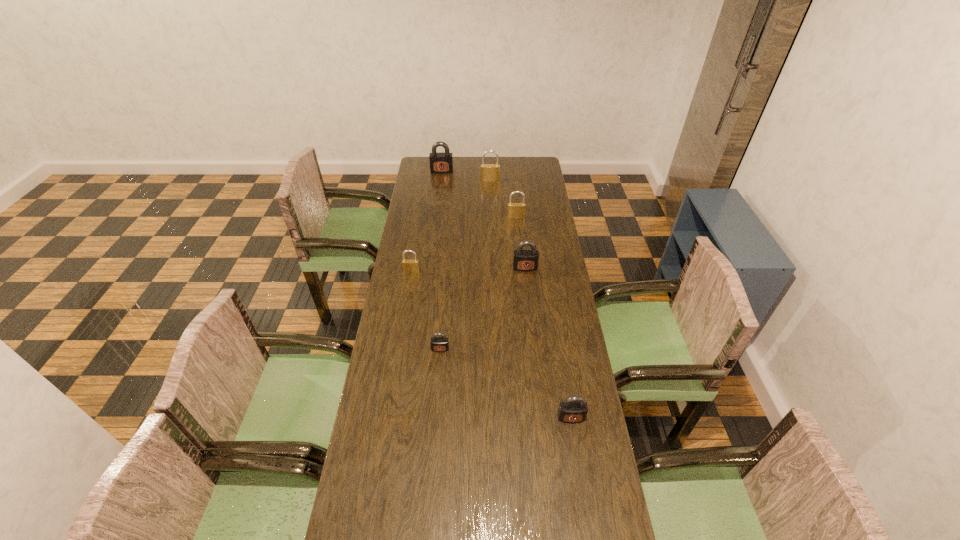
You are a GUI agent. You are given a task and a screenshot of the screen. Output one action in this format:
    pyautogui.click(x=<x>, y=<y>)
    Task: Click on the smallest brass padlock
    
    Given the screenshot: What is the action you would take?
    pyautogui.click(x=409, y=266)

Identify the location of the nearest brass padlock. (409, 266).

At what (x,y) coordinates should I click in order to perform the action: click on the second nearest gray padlock. Please return your answer as a coordinate pair (x, y). Looking at the image, I should click on (438, 344).

Find the location of `the second nearest object`. the second nearest object is located at coordinates (438, 344).

The height and width of the screenshot is (540, 960). Identify the location of vacant space positioned 0.340m on the front of the biggest gray padlock near the keyhole. (438, 210).

Where is `vacant area located on the front-facing side of the biggest brass padlock`? The image size is (960, 540). vacant area located on the front-facing side of the biggest brass padlock is located at coordinates (491, 210).

Identify the location of free location located on the front-facing side of the second farthest brass padlock. Image resolution: width=960 pixels, height=540 pixels. (518, 239).

Identify the location of free space located 0.400m on the front of the second biggest gray padlock near the keyhole. The width and height of the screenshot is (960, 540). (534, 347).

Locate an element on the screen. free space located 0.080m on the front of the rightmost gray padlock near the keyhole is located at coordinates (576, 448).

At what (x,y) coordinates should I click in order to perform the action: click on blank space located 0.240m on the front-facing side of the smallest brass padlock. Please return your answer as a coordinate pair (x, y). Looking at the image, I should click on coord(404,315).